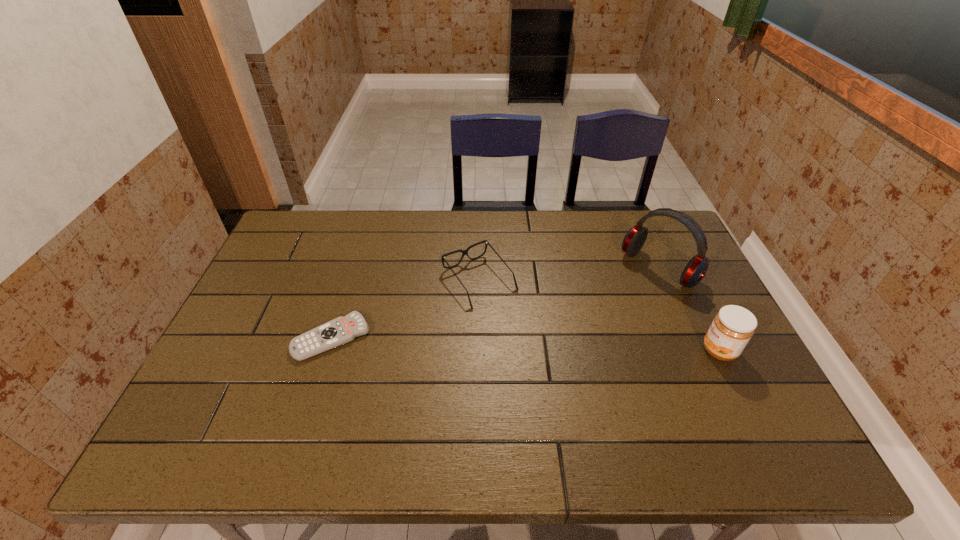
Locate an element on the screen. This screenshot has width=960, height=540. free space between the spectacles and the second tallest object is located at coordinates (599, 316).

This screenshot has width=960, height=540. Find the location of `free space between the jam and the earphone`. free space between the jam and the earphone is located at coordinates (689, 309).

I want to click on free space that is in between the earphone and the third tallest object, so click(x=569, y=275).

Where is `free space between the remote control and the third tallest object`? The width and height of the screenshot is (960, 540). free space between the remote control and the third tallest object is located at coordinates (405, 309).

At what (x,y) coordinates should I click in order to perform the action: click on free space that is in between the second tallest object and the remote control. Please return your answer as a coordinate pair (x, y). The image size is (960, 540). Looking at the image, I should click on (525, 344).

The image size is (960, 540). Identify the location of unoccupied position between the earphone and the jam. (689, 309).

Locate an element on the screen. The width and height of the screenshot is (960, 540). object that is the second closest to the third tallest object is located at coordinates (696, 269).

Identify the location of object that is the second closest to the earphone. point(464,252).

Locate an element on the screen. The height and width of the screenshot is (540, 960). blank space that satisfies the following two spatial constraints: 1. on the back side of the leftmost object; 2. on the left side of the spectacles is located at coordinates (349, 281).

In order to click on vacant area that satisfies the following two spatial constraints: 1. on the back side of the spectacles; 2. on the left side of the shortest object in this screenshot , I will do `click(349, 281)`.